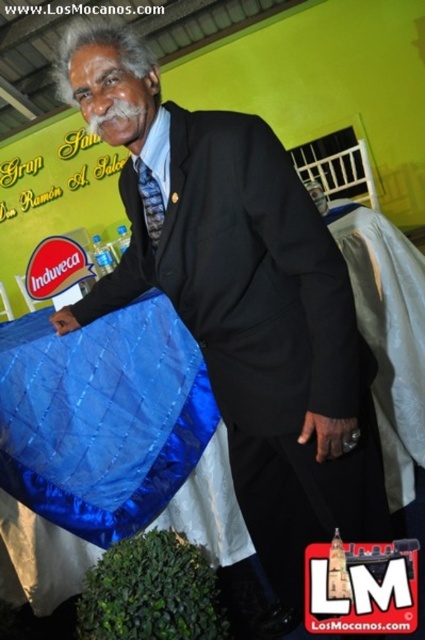
Which is in front, point (155, 500) or point (351, 234)?

Positioned in front is point (155, 500).

Is blue shiny bag at lower left taller than white fabric at right?

No, blue shiny bag at lower left is not taller than white fabric at right.

The height and width of the screenshot is (640, 425). Identify the location of blue shiny bag at lower left. (110, 444).

Where is `blue shiny bag at lower left`? The height and width of the screenshot is (640, 425). blue shiny bag at lower left is located at coordinates (110, 444).